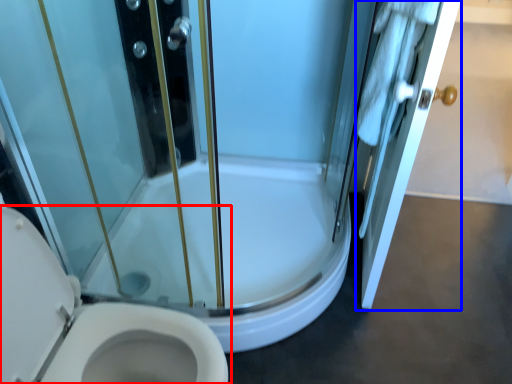
Question: Among these objects, which one is nearest to the camera, toilet (highlighted by a red box) or door (highlighted by a blue box)?

Choices:
 (A) toilet
 (B) door

Answer: (A)